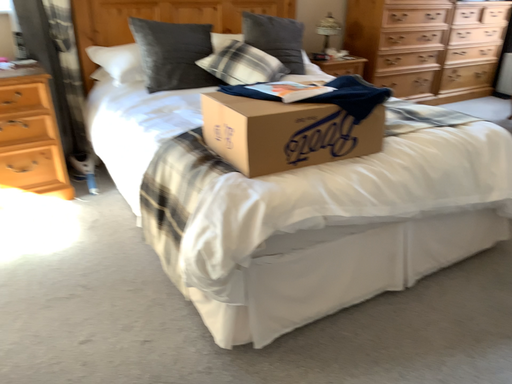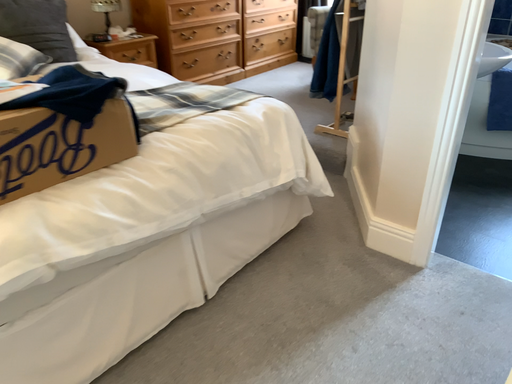
Question: Which way did the camera rotate in the video?

Choices:
 (A) rotated left
 (B) rotated right

Answer: (B)